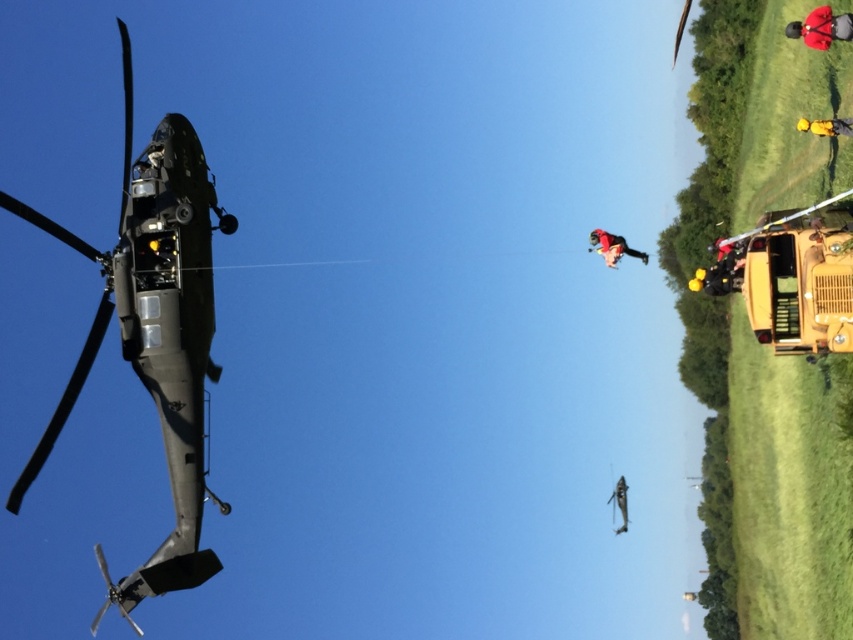
You are a safety officer assessing the scene. You notice the matte black helicopter at left and the red fabric helmet at upper right. Based on their sizes, which object would require more space for safe storage?

The matte black helicopter at left is bigger than the red fabric helmet at upper right, so it would require more space for safe storage.